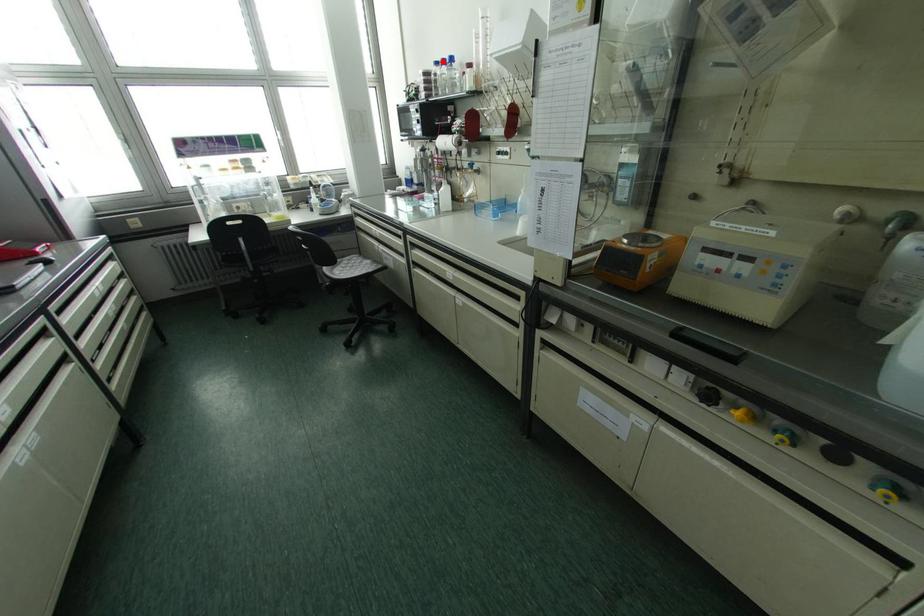
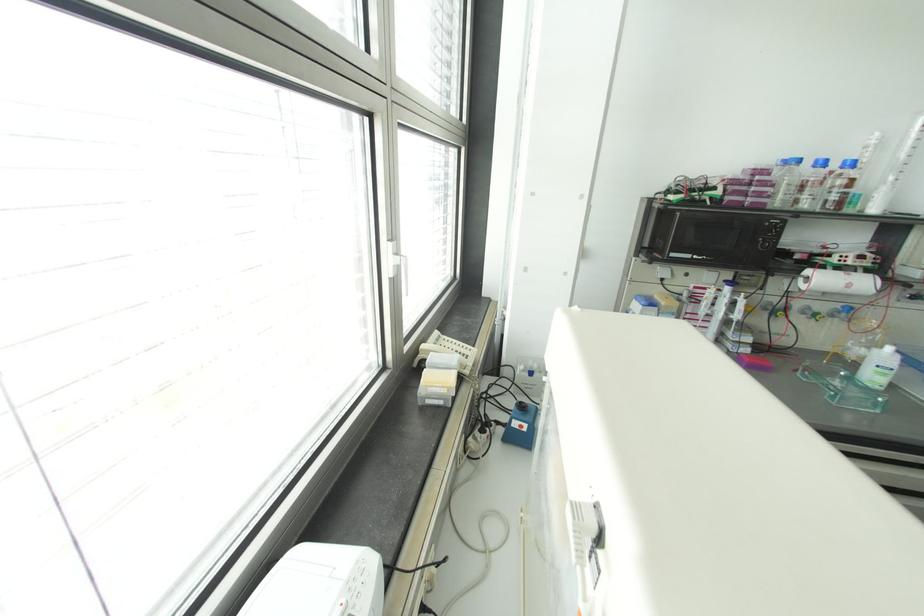
Question: I am providing you with two images of the same scene from different viewpoints. Given a red point in image1, look at the same physical point in image2. Is it:

Choices:
 (A) Closer to the viewpoint
 (B) Farther from the viewpoint

Answer: (B)